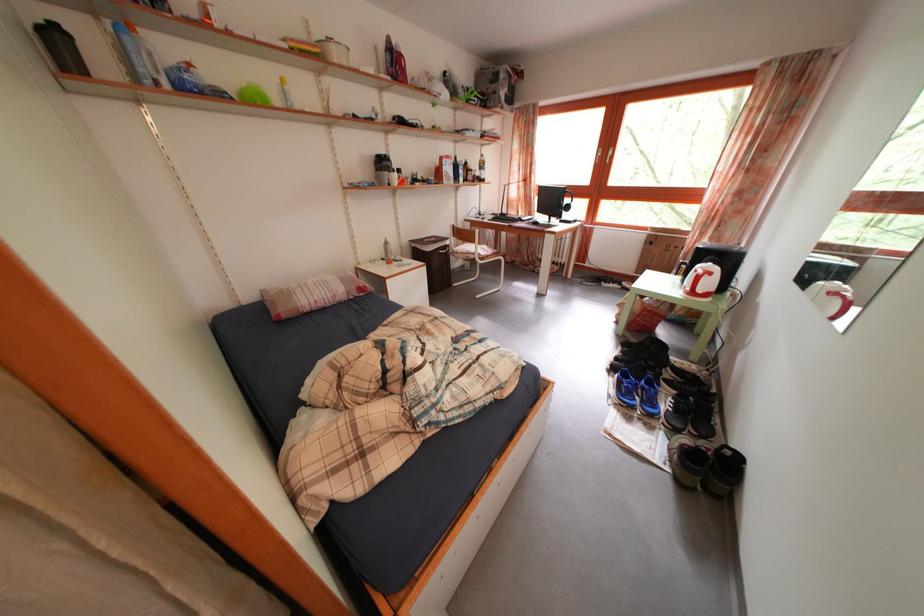
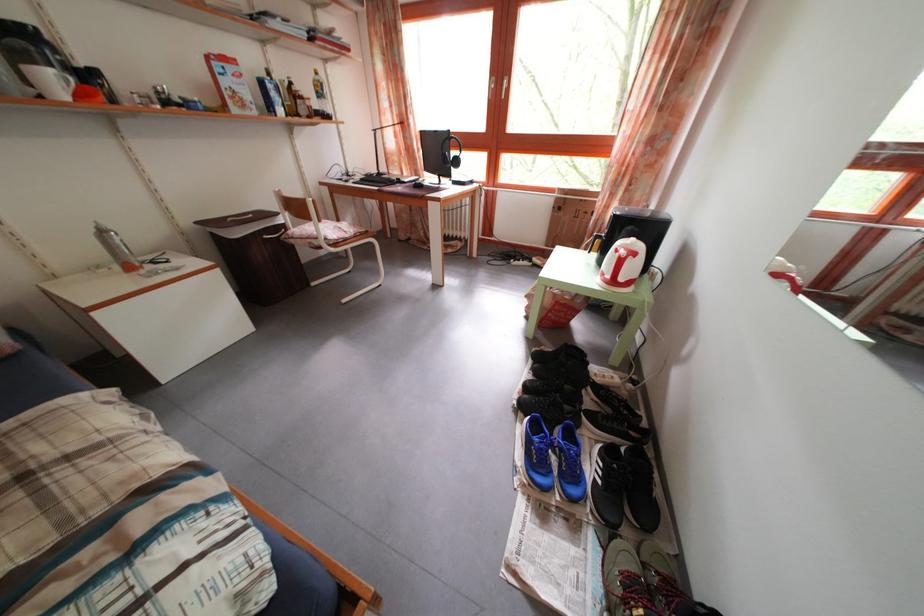
Locate, in the second image, the point that corresponds to point 672,411 in the first image.

(599, 477)